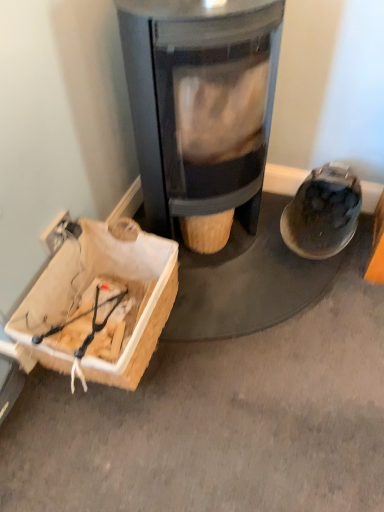
Where is `vacant area that is in front of matte black shoe at right`? The image size is (384, 512). vacant area that is in front of matte black shoe at right is located at coordinates (324, 302).